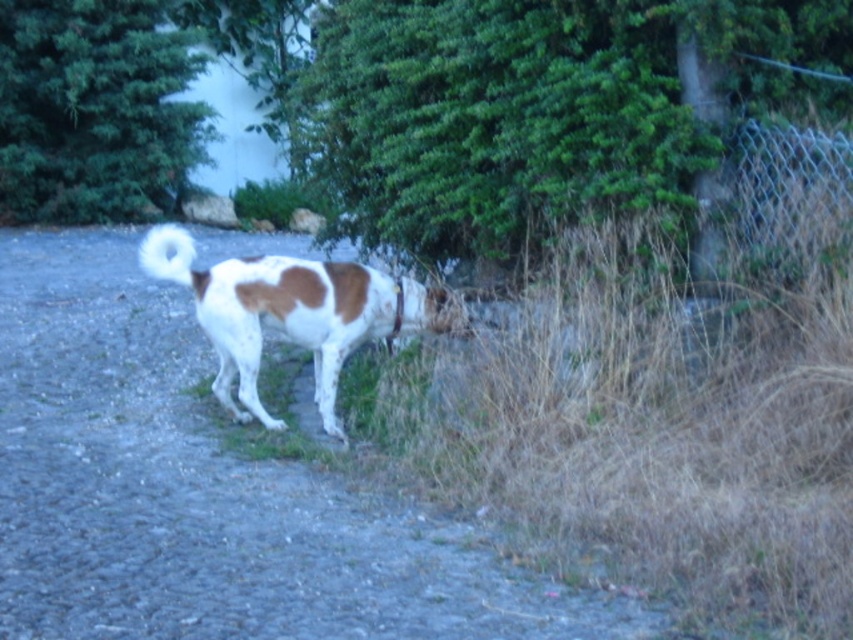
You are a hiker who just arrived at the path. You see the dirt track at center and the brown and white fur at center. Which one is closer to the ground?

The dirt track at center is positioned under brown and white fur at center, so the dirt track at center is closer to the ground.

You are standing on the cobblestone path and want to take a photo of the dog. You notice two points marked in the scene. Which point is closer to you, point (x=355, y=483) or point (x=337, y=355)?

Point (x=355, y=483) is closer to the camera than point (x=337, y=355).

You are a photographer trying to capture the white fluffy tail at upper left and the wire mesh fence at right in the same frame. Based on their positions, will the fence appear larger or smaller in the photo compared to the tail?

The wire mesh fence at right is closer to the viewer than the white fluffy tail at upper left, so the fence will appear larger in the photo than the tail.